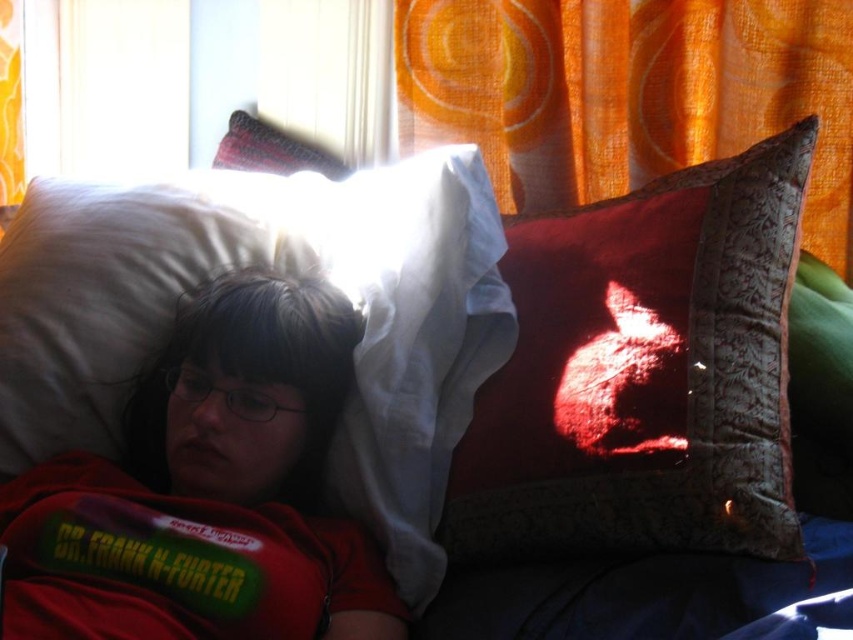
Who is taller, velvet red pillow at upper right or velvet-like red pillow at upper right?

Standing taller between the two is velvet-like red pillow at upper right.

Between velvet red pillow at upper right and velvet-like red pillow at upper right, which one appears on the right side from the viewer's perspective?

velvet red pillow at upper right

Between point (537, 435) and point (28, 273), which one is positioned behind?

Positioned behind is point (28, 273).

Identify the location of velvet red pillow at upper right. (643, 372).

Is velvet red pillow at upper right above orange sheer curtain at upper center?

Actually, velvet red pillow at upper right is below orange sheer curtain at upper center.

In the scene shown: Which is more to the left, velvet red pillow at upper right or orange sheer curtain at upper center?

→ velvet red pillow at upper right

Does point (488, 476) lie in front of point (569, 56)?

Yes, it is.

Locate an element on the screen. velvet red pillow at upper right is located at coordinates (643, 372).

The width and height of the screenshot is (853, 640). I want to click on velvet red pillow at upper right, so click(x=643, y=372).

Which is more to the right, velvet red pillow at upper right or velvet-like red pillow at upper left?

From the viewer's perspective, velvet red pillow at upper right appears more on the right side.

You are a GUI agent. You are given a task and a screenshot of the screen. Output one action in this format:
    pyautogui.click(x=<x>, y=<y>)
    Task: Click on the velvet red pillow at upper right
    
    Given the screenshot: What is the action you would take?
    pyautogui.click(x=643, y=372)

Where is `velvet red pillow at upper right`? The width and height of the screenshot is (853, 640). velvet red pillow at upper right is located at coordinates (643, 372).